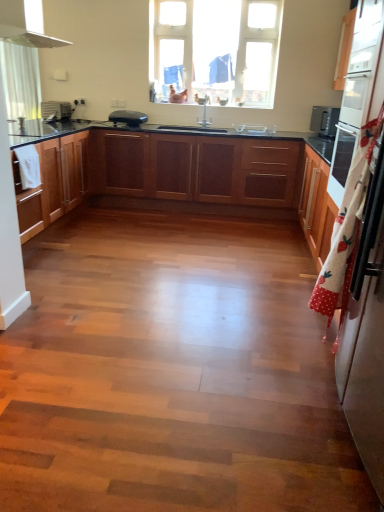
Question: Which direction should I rotate to face black plastic toaster at upper center, which ranks as the first appliance in right-to-left order, — up or down?

Choices:
 (A) down
 (B) up

Answer: (B)

Question: Are white glossy oven at right and matte black toaster at left, which appears as the 2th appliance when viewed from the right, far apart?

Choices:
 (A) no
 (B) yes

Answer: (B)

Question: From the image's perspective, does white glossy oven at right appear lower than matte black toaster at left, which appears as the 2th appliance when viewed from the right?

Choices:
 (A) no
 (B) yes

Answer: (B)

Question: Is white glossy oven at right positioned with its back to matte black toaster at left, which appears as the 2th appliance when viewed from the right?

Choices:
 (A) no
 (B) yes

Answer: (A)

Question: From a real-world perspective, is white glossy oven at right physically above matte black toaster at left, marked as the 1th appliance in a left-to-right arrangement?

Choices:
 (A) yes
 (B) no

Answer: (A)

Question: Is white glossy oven at right positioned beyond the bounds of matte black toaster at left, marked as the 1th appliance in a left-to-right arrangement?

Choices:
 (A) yes
 (B) no

Answer: (A)

Question: Does white glossy oven at right have a lesser width compared to matte black toaster at left, which appears as the 2th appliance when viewed from the right?

Choices:
 (A) yes
 (B) no

Answer: (A)

Question: From a real-world perspective, is white glossy refrigerator at right over white glossy exhaust hood at upper left?

Choices:
 (A) yes
 (B) no

Answer: (B)

Question: Is white glossy refrigerator at right at the right side of white glossy exhaust hood at upper left?

Choices:
 (A) yes
 (B) no

Answer: (A)

Question: Is white glossy refrigerator at right thinner than white glossy exhaust hood at upper left?

Choices:
 (A) yes
 (B) no

Answer: (A)

Question: Is white glossy refrigerator at right next to white glossy exhaust hood at upper left?

Choices:
 (A) no
 (B) yes

Answer: (A)

Question: Would you say white glossy refrigerator at right is a long distance from white glossy exhaust hood at upper left?

Choices:
 (A) yes
 (B) no

Answer: (A)

Question: From the image's perspective, is white glossy refrigerator at right below white glossy exhaust hood at upper left?

Choices:
 (A) yes
 (B) no

Answer: (A)

Question: Are white glossy refrigerator at right and wooden cabinets at left, acting as the 2th cabinetry starting from the back, far apart?

Choices:
 (A) no
 (B) yes

Answer: (B)